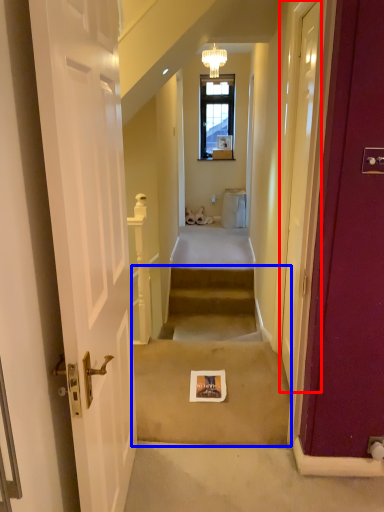
Question: Which object is closer to the camera taking this photo, door (highlighted by a red box) or stairwell (highlighted by a blue box)?

Choices:
 (A) door
 (B) stairwell

Answer: (A)